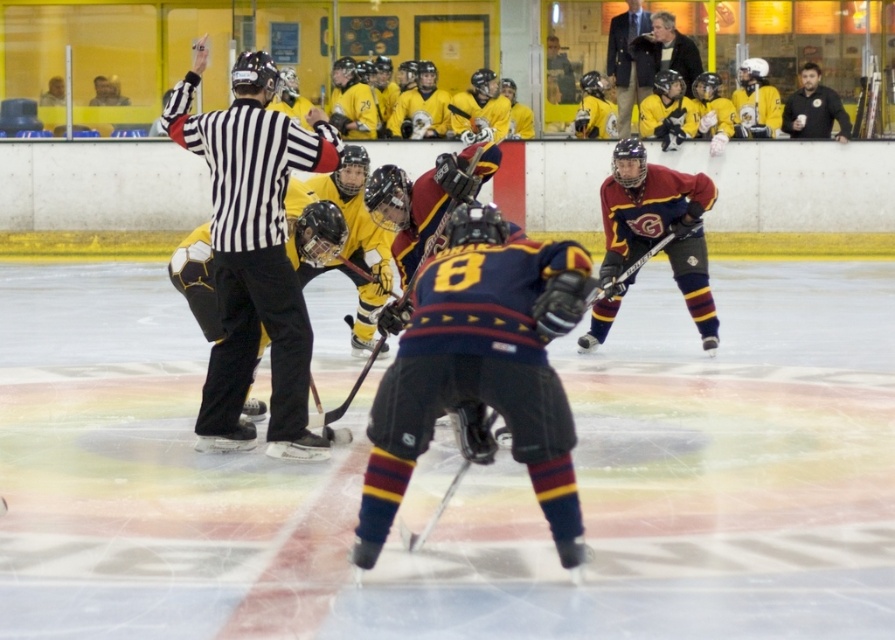
You are a spectator sitting at the edge of the ice rink. You notice the dark blue jersey at center and the dark brown leather jacket at upper right. Which object is positioned higher in the image?

The dark brown leather jacket at upper right is positioned higher in the image than the dark blue jersey at center.

You are a spectator sitting at the edge of the ice rink. You notice two items in the image. The first is the dark blue jersey at center, and the second is the dark brown leather jacket at upper right. Which item appears larger in the image?

The dark blue jersey at center appears much larger than the dark brown leather jacket at upper right because it is much taller as stated in the description.

You are a photographer trying to capture the action of the ice hockey game. You notice the dark blue jersey at center and the dark brown leather jacket at upper right. Which one appears smaller in the photo?

The dark blue jersey at center appears smaller because it occupies less space than the dark brown leather jacket at upper right in the photo.